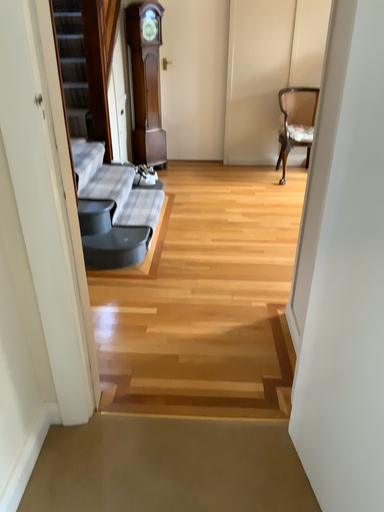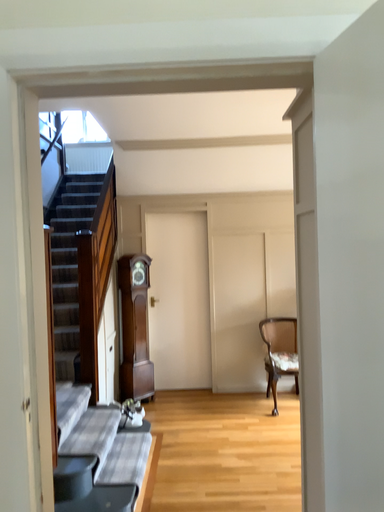
Question: Which way did the camera rotate in the video?

Choices:
 (A) rotated upward
 (B) rotated downward

Answer: (A)